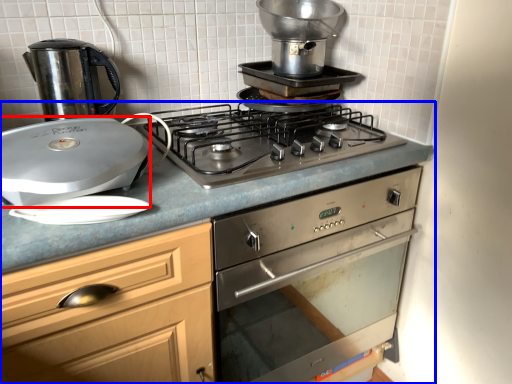
Question: Which point is further to the camera, kitchen appliance (highlighted by a red box) or countertop (highlighted by a blue box)?

Choices:
 (A) kitchen appliance
 (B) countertop

Answer: (A)